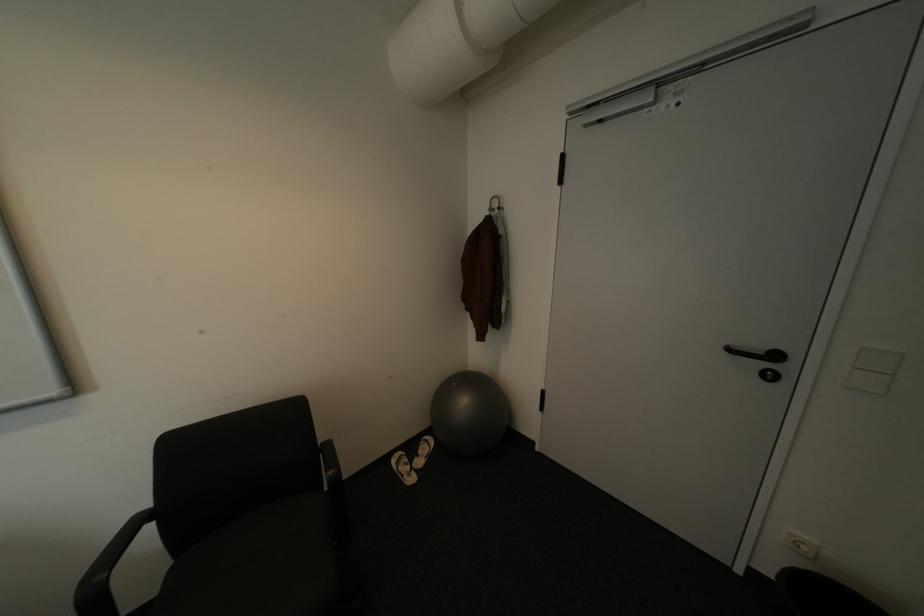
This screenshot has width=924, height=616. Identify the location of black door handle. (761, 360).